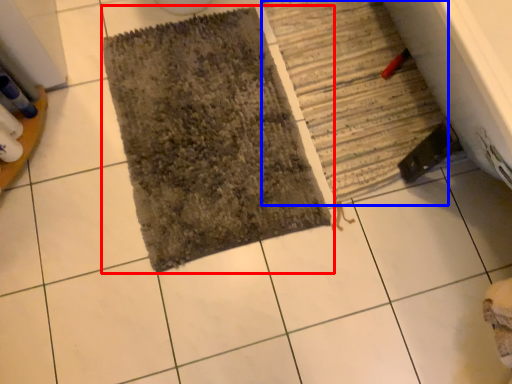
Question: Among these objects, which one is nearest to the camera, bath mat (highlighted by a red box) or bath mat (highlighted by a blue box)?

Choices:
 (A) bath mat
 (B) bath mat

Answer: (A)